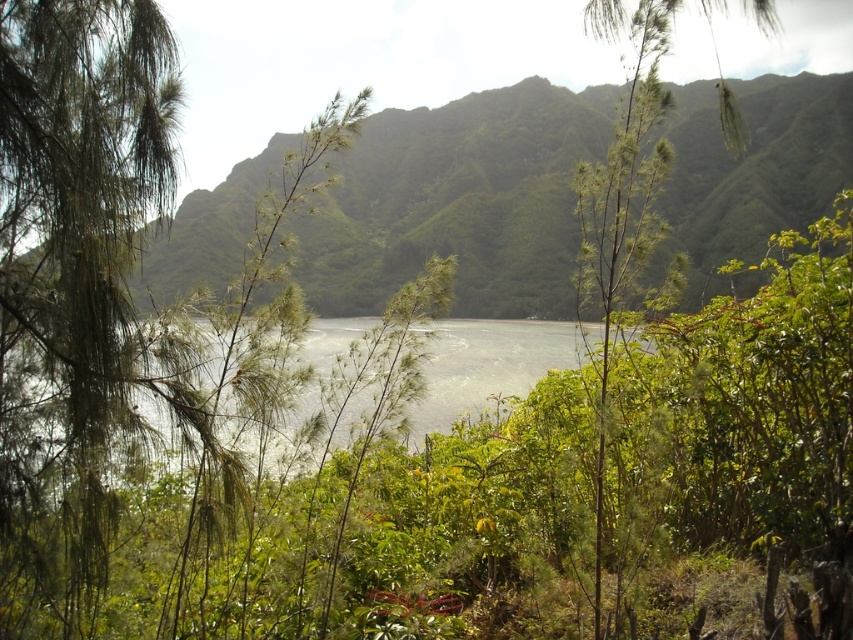
Question: Can you confirm if green leafy hillside at upper center is positioned to the right of green leafy tree at center?

Choices:
 (A) no
 (B) yes

Answer: (A)

Question: Which point appears closest to the camera in this image?

Choices:
 (A) (305, 344)
 (B) (581, 262)

Answer: (B)

Question: Can you confirm if green leafy hillside at upper center is bigger than green leafy tree at center?

Choices:
 (A) yes
 (B) no

Answer: (A)

Question: Which point is farther to the camera?

Choices:
 (A) green leafy tree at center
 (B) clear water at center

Answer: (A)

Question: Is green leafy hillside at upper center positioned behind clear water at center?

Choices:
 (A) no
 (B) yes

Answer: (B)

Question: Which object is closer to the camera taking this photo?

Choices:
 (A) clear water at center
 (B) green leafy tree at center

Answer: (A)